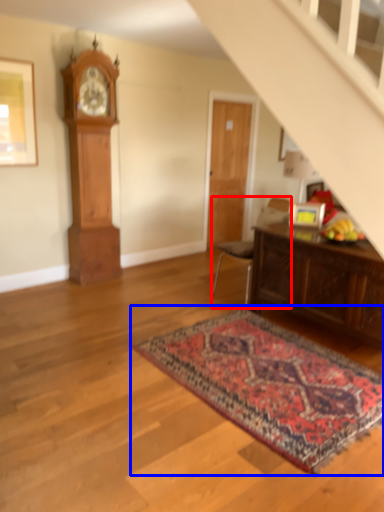
Question: Which object appears farthest to the camera in this image, chair (highlighted by a red box) or mat (highlighted by a blue box)?

Choices:
 (A) chair
 (B) mat

Answer: (A)